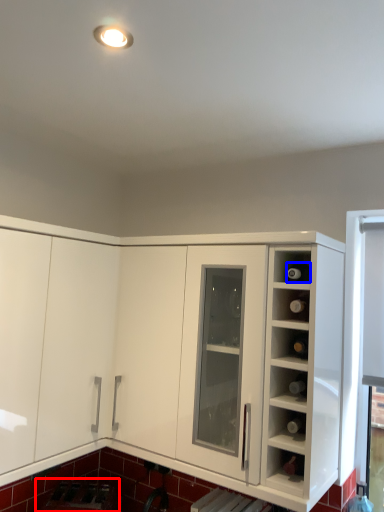
Question: Which object is further to the camera taking this photo, appliance (highlighted by a red box) or wine bottle (highlighted by a blue box)?

Choices:
 (A) appliance
 (B) wine bottle

Answer: (A)